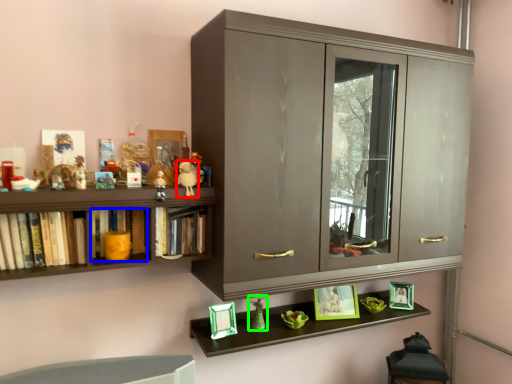
Question: Based on their relative distances, which object is nearer to toy (highlighted by a red box)? Choose from book (highlighted by a blue box) and toy (highlighted by a green box).

Choices:
 (A) book
 (B) toy

Answer: (A)